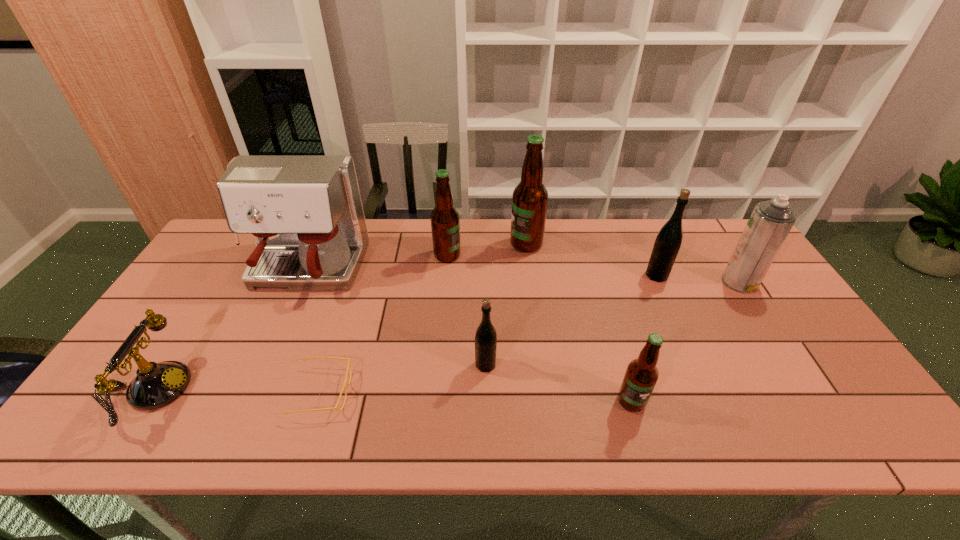
At what (x,y) coordinates should I click in order to perform the action: click on coffee maker located in the left edge section of the desktop. Please return your answer as a coordinate pair (x, y). This screenshot has height=540, width=960. Looking at the image, I should click on (305, 212).

Find the location of a particular element. telephone present at the left edge is located at coordinates (156, 385).

Find the location of a particular element. object located at the right edge is located at coordinates (771, 221).

Identify the location of object that is at the far left corner. The width and height of the screenshot is (960, 540). coord(305,212).

This screenshot has height=540, width=960. What are the coordinates of `object at the near left corner` in the screenshot? It's located at (156, 385).

Image resolution: width=960 pixels, height=540 pixels. What are the coordinates of `vacant space at the far edge of the desktop` in the screenshot? It's located at (432, 245).

Identify the location of vacant area at the near edge. This screenshot has height=540, width=960. (521, 440).

The height and width of the screenshot is (540, 960). In the image, there is a desktop. Find the location of `free region at the left edge`. free region at the left edge is located at coordinates 211,267.

Find the location of a particular element. vacant space at the near left corner is located at coordinates (119, 429).

Identify the location of blank area at the far right corner. (730, 234).